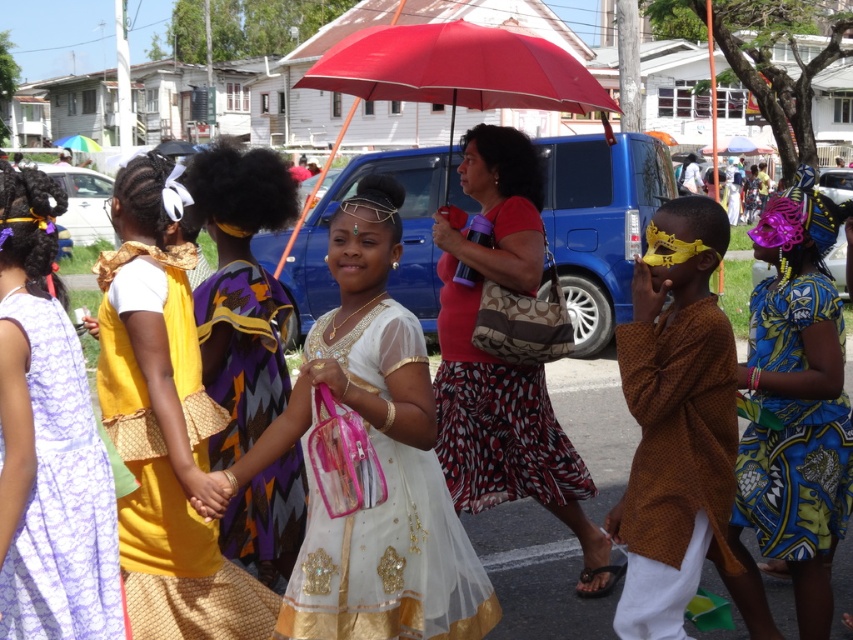
You are a photographer trying to capture the children in their traditional outfits. You notice the white sheer dress at center and the matte yellow dress at center. Which child should you focus on first if you want to photograph the one closer to the ground?

The white sheer dress at center is located below the matte yellow dress at center, so you should focus on the child wearing the white sheer dress at center first as they are closer to the ground.

You are standing at the point marked by the coordinates point (503,360). Looking around, you see a red fabric umbrella at center. What object is located at the coordinates point 0.591, 0.564?

The coordinates point 0.591, 0.564 is not mentioned in the provided information. The only coordinates given are point (503,360), which indicates the location of the red fabric umbrella at center.

You are a photographer standing at the center of the street scene. You want to capture a photo that includes the red fabric umbrella at center. Based on its coordinates, where should you position your camera to ensure the umbrella is centered in the frame?

To center the red fabric umbrella at center in the frame, position your camera at the coordinates provided, which are at point (503, 360). This will ensure the umbrella is centered in the photo.